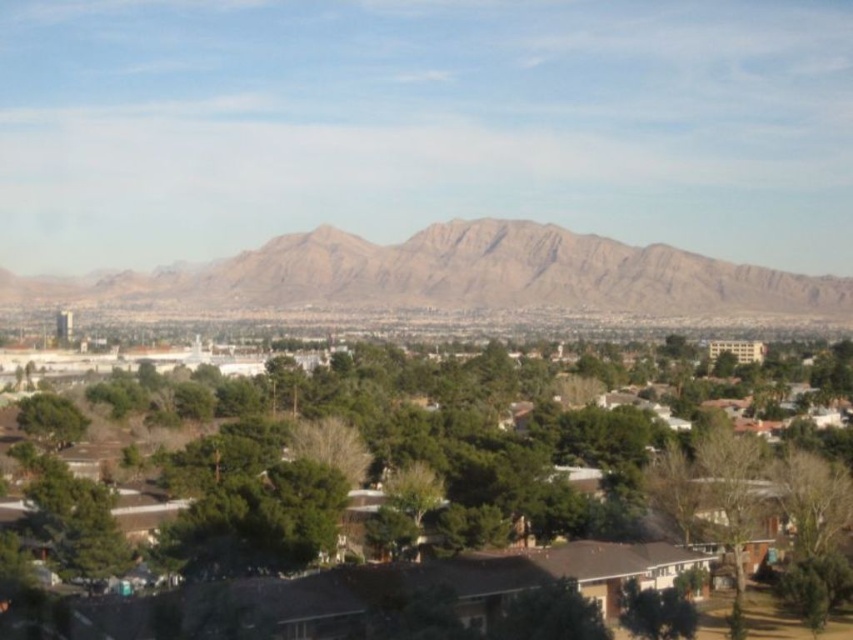
Is the position of green leafy tree at center more distant than that of brown rocky mountain range at center?

No, green leafy tree at center is closer to the viewer.

Who is higher up, green leafy tree at center or brown rocky mountain range at center?

brown rocky mountain range at center is above.

This screenshot has width=853, height=640. Find the location of `green leafy tree at center`. green leafy tree at center is located at coordinates (402, 506).

Locate an element on the screen. This screenshot has height=640, width=853. green leafy tree at center is located at coordinates (402, 506).